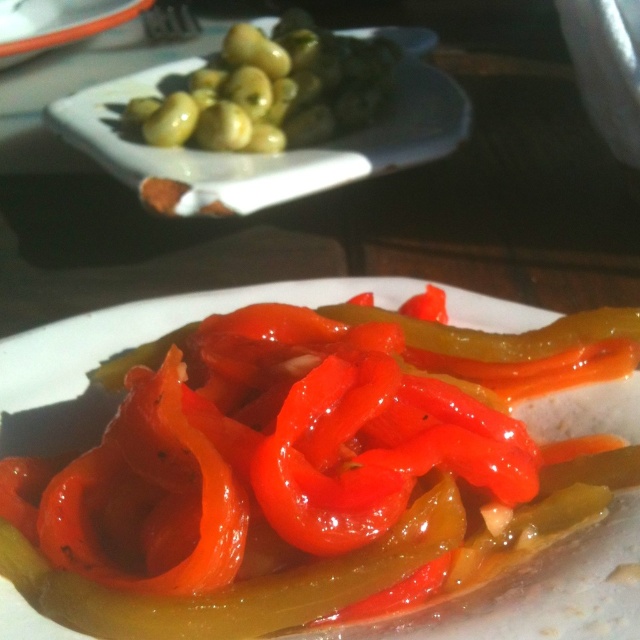
Question: Is glossy red pepper at center wider than green glossy olives at upper left?

Choices:
 (A) yes
 (B) no

Answer: (A)

Question: Which object appears farthest from the camera in this image?

Choices:
 (A) green glossy olives at upper left
 (B) glossy red pepper at center

Answer: (A)

Question: Can you confirm if glossy red pepper at center is positioned below green glossy olives at upper left?

Choices:
 (A) yes
 (B) no

Answer: (A)

Question: Which of the following is the closest to the observer?

Choices:
 (A) (224, 38)
 (B) (548, 561)

Answer: (B)

Question: Does glossy red pepper at center have a greater width compared to green glossy olives at upper left?

Choices:
 (A) yes
 (B) no

Answer: (A)

Question: Which object is farther from the camera taking this photo?

Choices:
 (A) green glossy olives at upper left
 (B) glossy red pepper at center

Answer: (A)